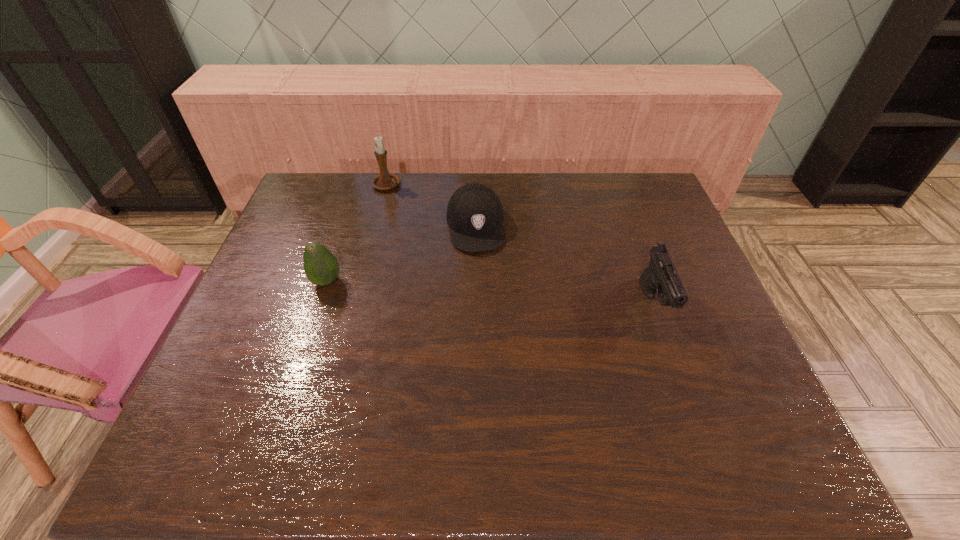
Find the location of `vacant point located between the avocado and the farthest object`. vacant point located between the avocado and the farthest object is located at coordinates point(356,234).

You are a GUI agent. You are given a task and a screenshot of the screen. Output one action in this format:
    pyautogui.click(x=<x>, y=<y>)
    Task: Click on the vacant space that's between the farthest object and the rightmost object
    The height and width of the screenshot is (540, 960).
    Given the screenshot: What is the action you would take?
    pyautogui.click(x=520, y=245)

Locate an element on the screen. The height and width of the screenshot is (540, 960). free space between the tallest object and the leftmost object is located at coordinates (356, 234).

Locate an element on the screen. This screenshot has width=960, height=540. vacant region between the second object from left to right and the second object from right to left is located at coordinates (431, 206).

Locate which object is the closest to the avocado. Please provide its 2D coordinates. Your answer should be formatted as a tuple, i.e. [(x, y)], where the tuple contains the x and y coordinates of a point satisfying the conditions above.

[(474, 214)]

Locate which object is the second closest to the rightmost object. Please provide its 2D coordinates. Your answer should be formatted as a tuple, i.e. [(x, y)], where the tuple contains the x and y coordinates of a point satisfying the conditions above.

[(384, 181)]

This screenshot has width=960, height=540. I want to click on blank space that satisfies the following two spatial constraints: 1. on the front side of the third object from left to right; 2. on the left side of the third object from right to left, so click(375, 226).